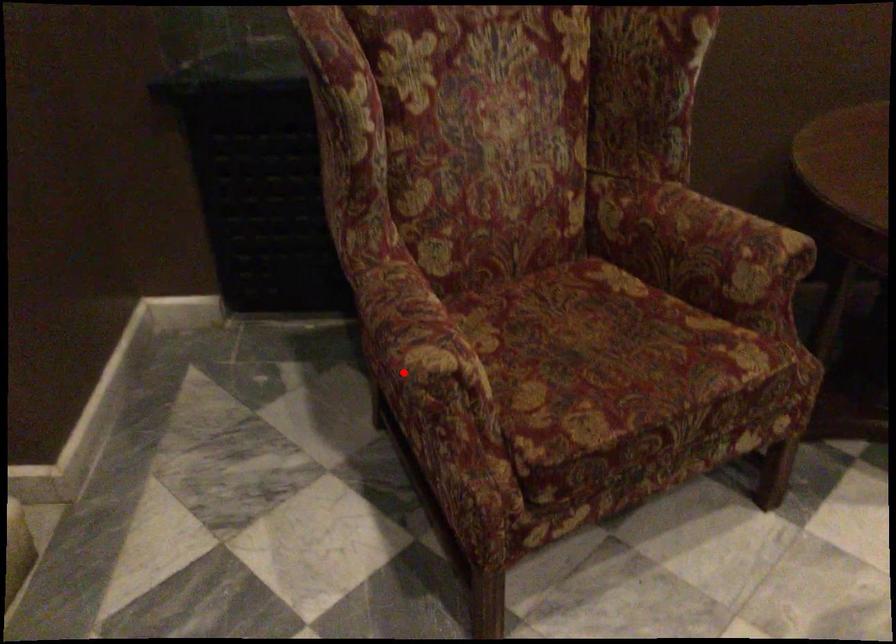
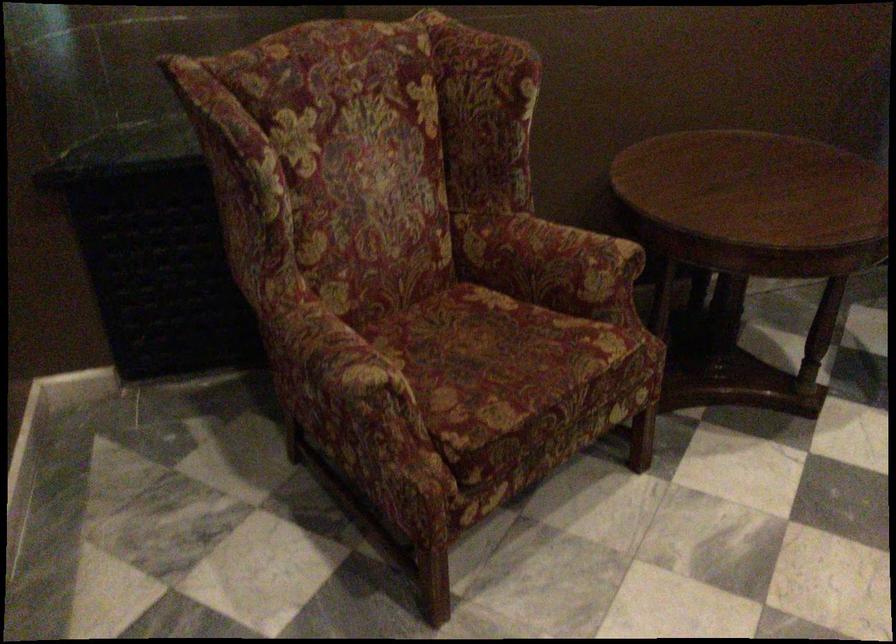
Question: I am providing you with two images of the same scene from different viewpoints. In image1, a red point is highlighted. Considering the same 3D point in image2, which of the following is correct?

Choices:
 (A) It is closer
 (B) It is farther

Answer: (B)